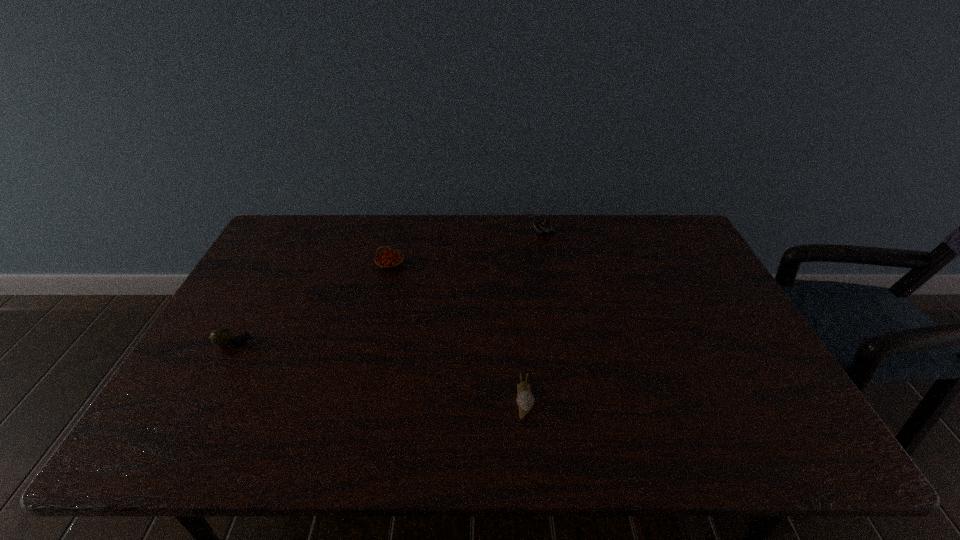
I want to click on free space located on the face of the farthest escargot, so click(467, 232).

Locate an element on the screen. The image size is (960, 540). free region located on the right of the second farthest object is located at coordinates (522, 265).

Locate an element on the screen. Image resolution: width=960 pixels, height=540 pixels. vacant space located on the front-facing side of the second farthest escargot is located at coordinates (359, 343).

Where is `object at the far edge`? The width and height of the screenshot is (960, 540). object at the far edge is located at coordinates (546, 225).

Identify the location of object that is at the near edge. (525, 400).

This screenshot has width=960, height=540. In order to click on object that is positioned at the left edge in this screenshot , I will do `click(222, 337)`.

In the image, there is a desktop. At what (x,y) coordinates should I click in order to perform the action: click on vacant space at the far edge. Please return your answer as a coordinate pair (x, y). This screenshot has width=960, height=540. Looking at the image, I should click on (336, 236).

Locate an element on the screen. The width and height of the screenshot is (960, 540). free point at the near edge is located at coordinates (348, 456).

In the image, there is a desktop. In order to click on vacant space at the left edge in this screenshot , I will do `click(278, 279)`.

Find the location of a particular element. The height and width of the screenshot is (540, 960). blank space at the right edge of the desktop is located at coordinates (710, 321).